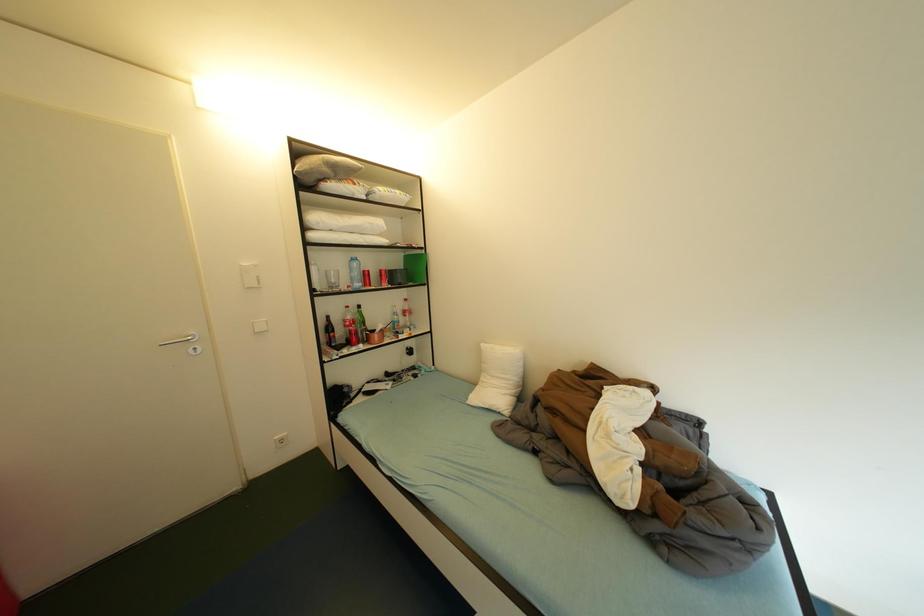
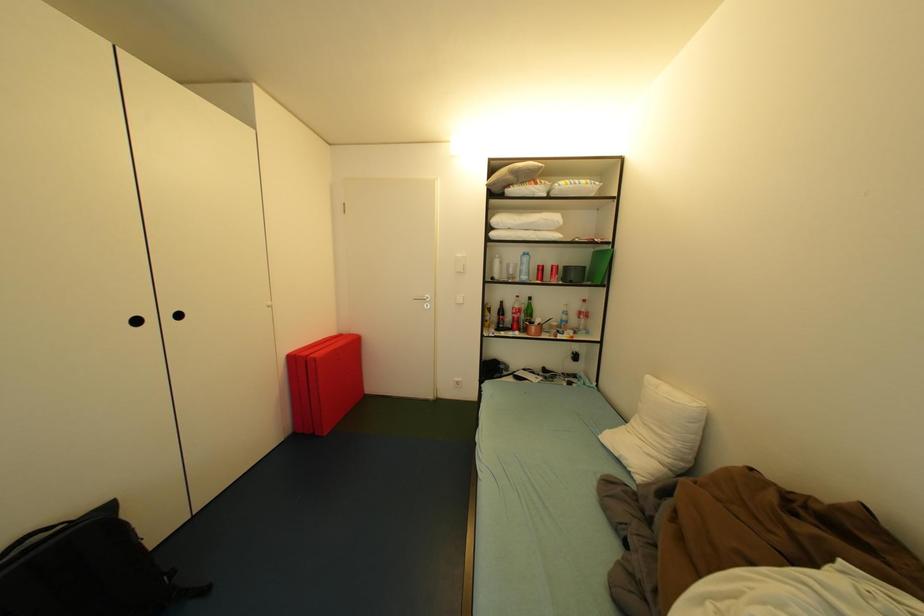
Question: The first image is from the beginning of the video and the second image is from the end. How did the camera likely rotate when shooting the video?

Choices:
 (A) Left
 (B) Right
 (C) Up
 (D) Down

Answer: (A)